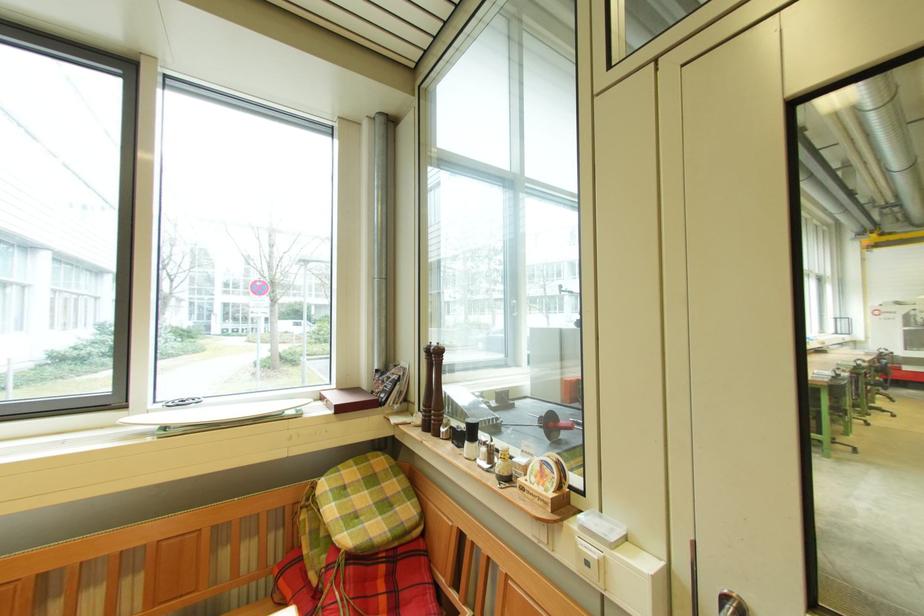
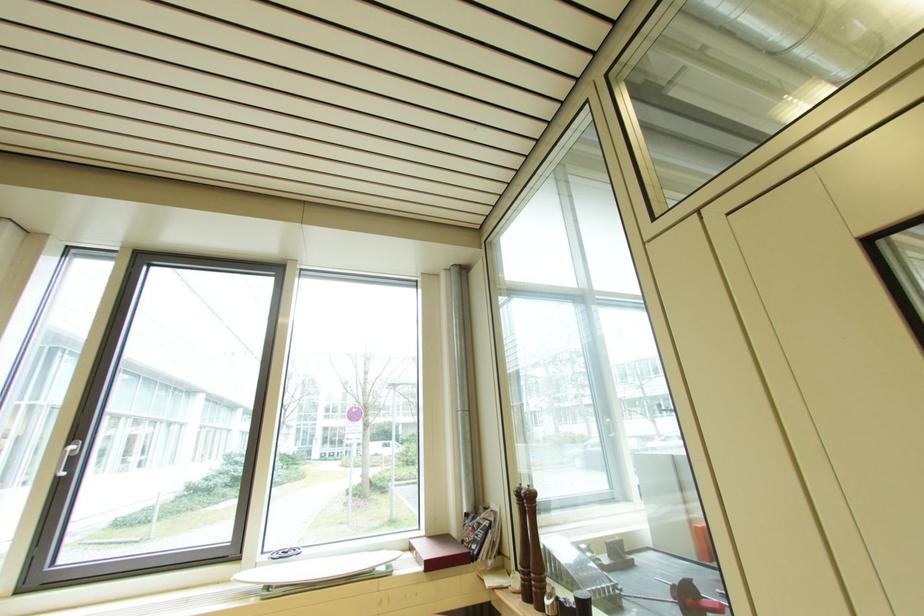
The point at (163, 413) is marked in the first image. Where is the corresponding point in the second image?

(271, 567)